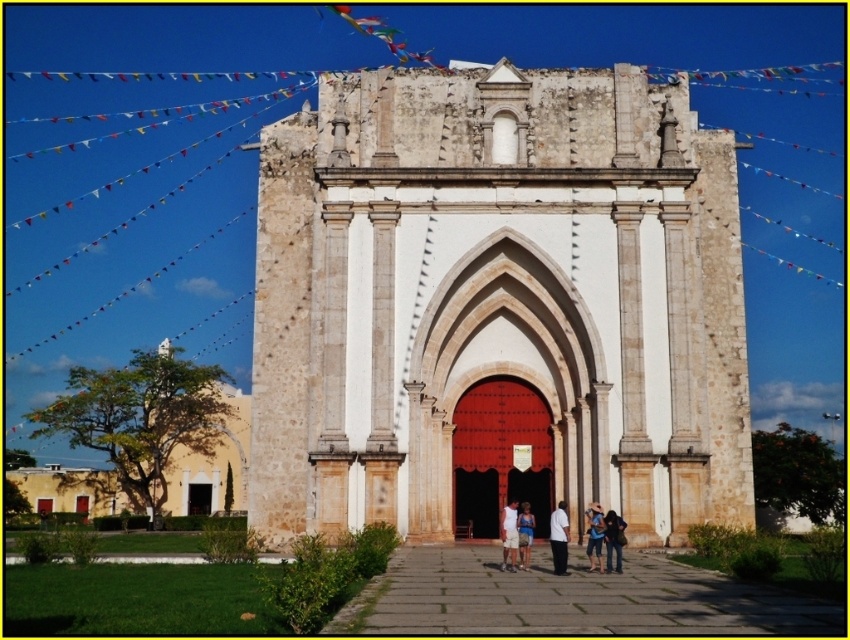
Looking at this image, between smooth wooden door at center and white cotton tank top at center, which one appears on the right side from the viewer's perspective?

smooth wooden door at center is more to the right.

Does smooth wooden door at center have a lesser width compared to white cotton tank top at center?

No.

At what (x,y) coordinates should I click in order to perform the action: click on smooth wooden door at center. Please return your answer as a coordinate pair (x, y). The image size is (850, 640). Looking at the image, I should click on (500, 452).

This screenshot has width=850, height=640. Identify the location of smooth wooden door at center. (500, 452).

Is smooth wooden door at center behind white matte shirt at center?

That is True.

Between smooth wooden door at center and white matte shirt at center, which one is positioned higher?

Positioned higher is smooth wooden door at center.

Is point (479, 404) less distant than point (564, 544)?

No, (479, 404) is further to viewer.

Image resolution: width=850 pixels, height=640 pixels. I want to click on smooth wooden door at center, so click(x=500, y=452).

Is point (564, 561) farther from viewer compared to point (530, 536)?

That is False.

Who is taller, white matte shirt at center or blue fabric shirt at center?

Standing taller between the two is white matte shirt at center.

This screenshot has height=640, width=850. What do you see at coordinates (559, 538) in the screenshot?
I see `white matte shirt at center` at bounding box center [559, 538].

Identify the location of white matte shirt at center. (559, 538).